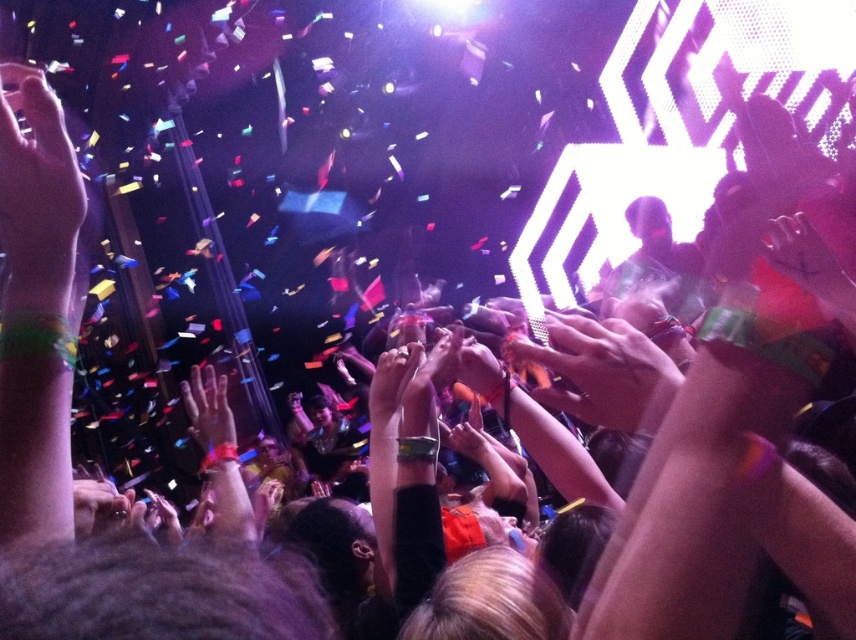
You are a photographer at the concert trying to capture a clear shot of the stage. There are two hands in your viewfinder, a matte skin hand at upper left and a matte skin hand at center. Which hand is blocking your view more due to its position?

The matte skin hand at upper left is blocking the view more because it has a greater height compared to the matte skin hand at center, meaning it is positioned higher and closer to the camera.

You are a photographer at the event and want to capture a closeup of the two hands, matte skin hand at upper left and matte skin hand at center. Which hand should you focus on if you want to capture more details due to its size?

The matte skin hand at upper left is larger in size compared to the matte skin hand at center, so focusing on the matte skin hand at upper left will allow you to capture more details due to its larger size.

You are a photographer trying to capture a photo of the crowd at the concert. You notice two points in the image, point A at coordinates point (15, 292) and point B at coordinates point (233, 424). If you want to focus on the point that is nearer to your camera, which coordinate should you adjust your lens to focus on?

Point A at coordinates point (15, 292) is closer to the camera than point B at coordinates point (233, 424). Therefore, you should focus your lens on point A at coordinates point (15, 292) to capture the nearer point.